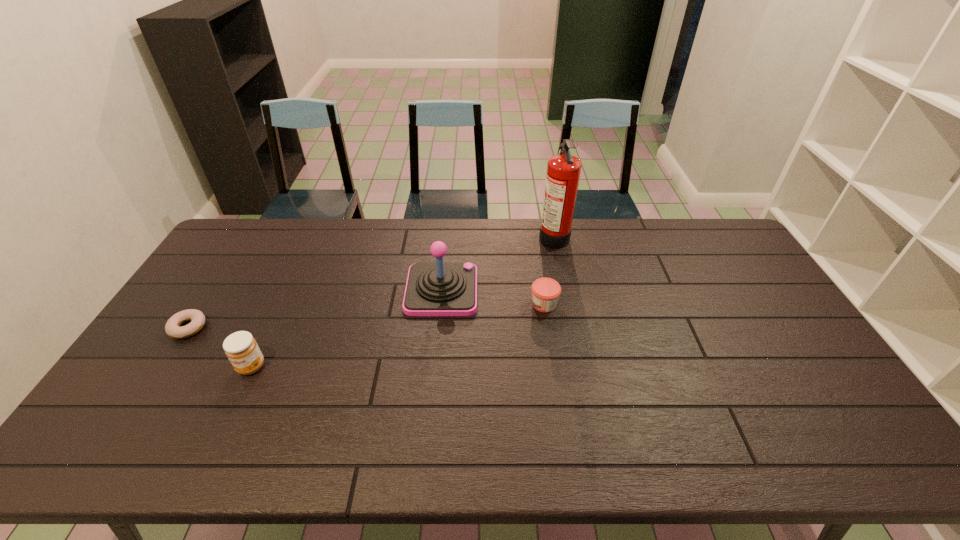
Locate an element on the screen. vacant area that lies between the shortest object and the farthest object is located at coordinates (371, 281).

The width and height of the screenshot is (960, 540). Find the location of `free area in between the third object from right to left and the doughnut`. free area in between the third object from right to left and the doughnut is located at coordinates (315, 309).

Where is `free space between the nearest object and the third object from left to right`? The width and height of the screenshot is (960, 540). free space between the nearest object and the third object from left to right is located at coordinates (347, 328).

The height and width of the screenshot is (540, 960). I want to click on empty space between the second shortest object and the third shortest object, so click(397, 335).

Locate an element on the screen. empty location between the nearest object and the shortest object is located at coordinates (220, 347).

This screenshot has width=960, height=540. What are the coordinates of `the second closest object to the nearer jam` in the screenshot? It's located at point(432,289).

Locate which object is the second closest to the taller jam. Please provide its 2D coordinates. Your answer should be formatted as a tuple, i.e. [(x, y)], where the tuple contains the x and y coordinates of a point satisfying the conditions above.

[(432, 289)]

I want to click on vacant point that satisfies the following two spatial constraints: 1. on the front label of the fourth tallest object; 2. on the front label of the second object from left to right, so click(x=554, y=367).

You are a GUI agent. You are given a task and a screenshot of the screen. Output one action in this format:
    pyautogui.click(x=<x>, y=<y>)
    Task: Click on the free space that satisfies the following two spatial constraints: 1. on the front label of the farther jam; 2. on the front label of the nearest object
    
    Given the screenshot: What is the action you would take?
    pyautogui.click(x=554, y=367)